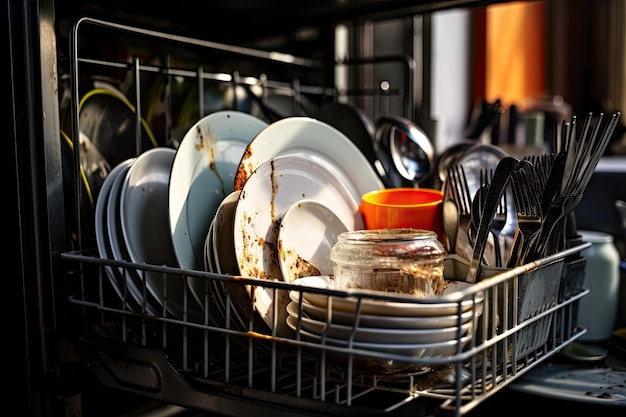
Locate an element on the screen. The image size is (626, 417). dish rack is located at coordinates (453, 359), (352, 343), (275, 331), (223, 326).